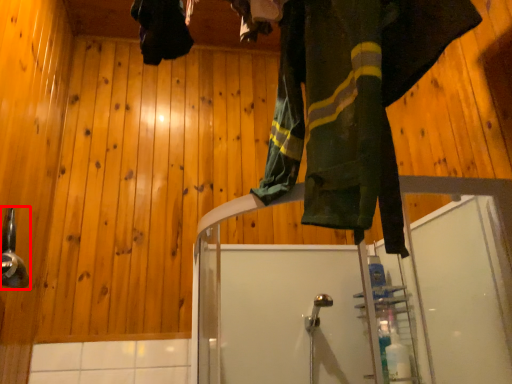
Question: From the image's perspective, what is the correct spatial relationship of shower (annotated by the red box) in relation to clothing?

Choices:
 (A) below
 (B) above

Answer: (A)